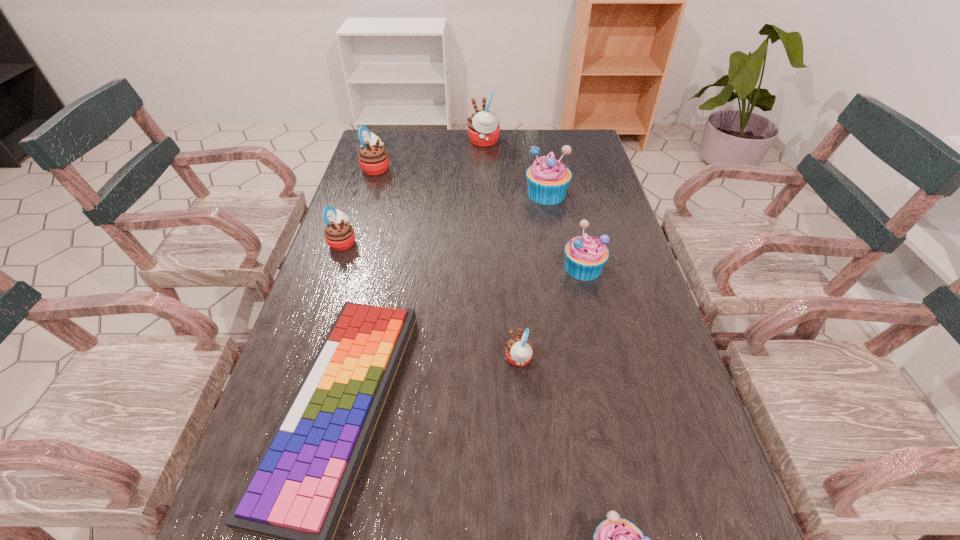
Find the location of `the closest object to the nearest blue muffin`. the closest object to the nearest blue muffin is located at coordinates (518, 350).

I want to click on object that stands as the seventh closest to the shortest object, so click(483, 126).

You are a GUI agent. You are given a task and a screenshot of the screen. Output one action in this format:
    pyautogui.click(x=<x>, y=<y>)
    Task: Click on the muffin that is the third nearest to the computer keyboard
    
    Given the screenshot: What is the action you would take?
    pyautogui.click(x=615, y=539)

You are a GUI agent. You are given a task and a screenshot of the screen. Output one action in this format:
    pyautogui.click(x=<x>, y=<y>)
    Task: Click on the muffin identified as the closest to the shortest object
    Image resolution: width=960 pixels, height=540 pixels.
    Given the screenshot: What is the action you would take?
    pyautogui.click(x=518, y=350)

Locate which pink muffin ranks fourth in proximity to the sixth nearest object. Please provide its 2D coordinates. Your answer should be formatted as a tuple, i.e. [(x, y)], where the tuple contains the x and y coordinates of a point satisfying the conditions above.

[(518, 350)]

Image resolution: width=960 pixels, height=540 pixels. Find the location of `pink muffin identified as the third closest to the fourth farthest muffin`. pink muffin identified as the third closest to the fourth farthest muffin is located at coordinates (483, 126).

Identify which blue muffin is located as the second nearest to the sixth nearest muffin. Please provide its 2D coordinates. Your answer should be formatted as a tuple, i.e. [(x, y)], where the tuple contains the x and y coordinates of a point satisfying the conditions above.

[(585, 255)]

Where is `the second closest blue muffin to the nearest pink muffin`? the second closest blue muffin to the nearest pink muffin is located at coordinates (615, 539).

Locate an element on the screen. free space that satisfies the following two spatial constraints: 1. on the front side of the second farthest blue muffin; 2. on the front-facing side of the smallest pink muffin is located at coordinates (605, 359).

Locate an element on the screen. The image size is (960, 540). vacant space that satisfies the following two spatial constraints: 1. on the front-facing side of the second farthest muffin; 2. on the left side of the second biggest blue muffin is located at coordinates (345, 267).